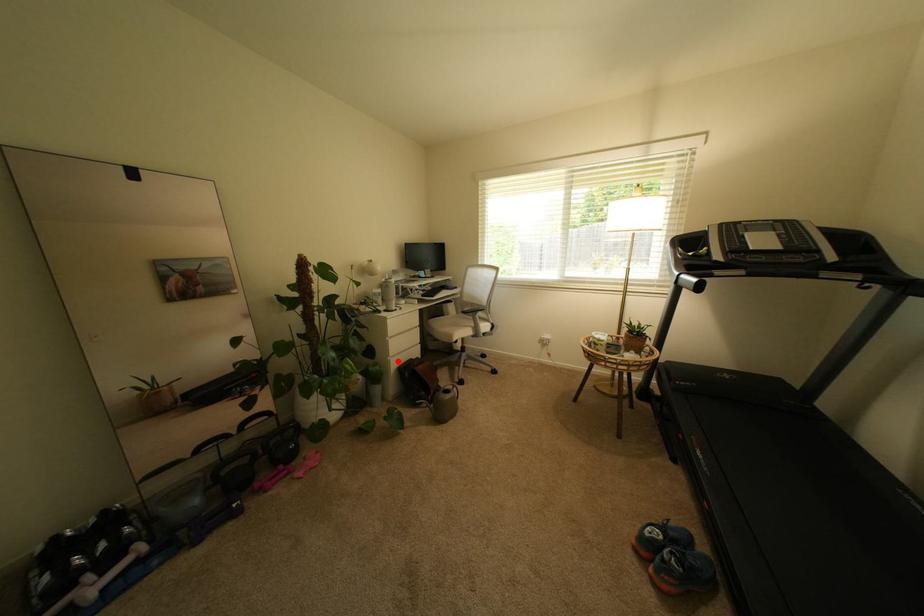
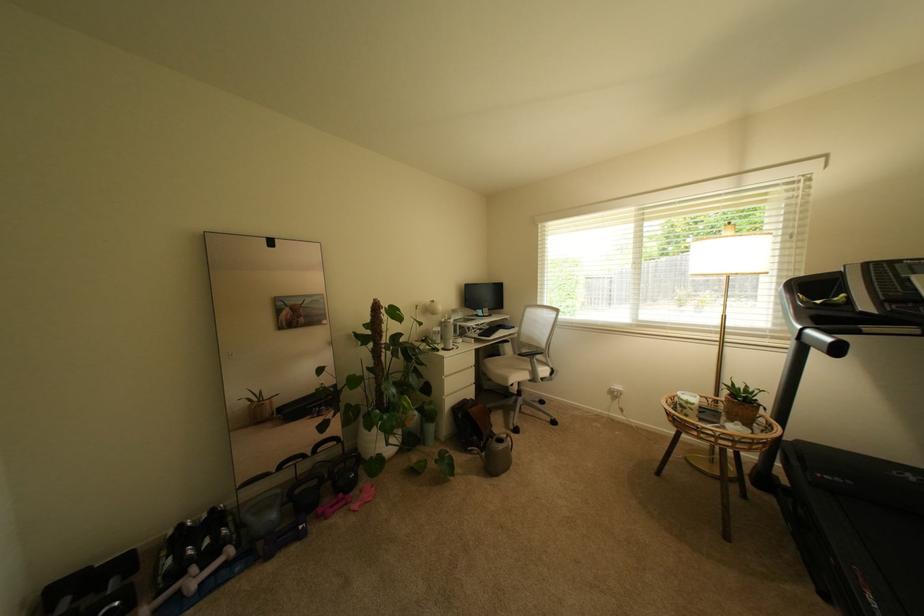
Where in the second image is the point corresponding to the highlighted location from the first image?

(453, 400)